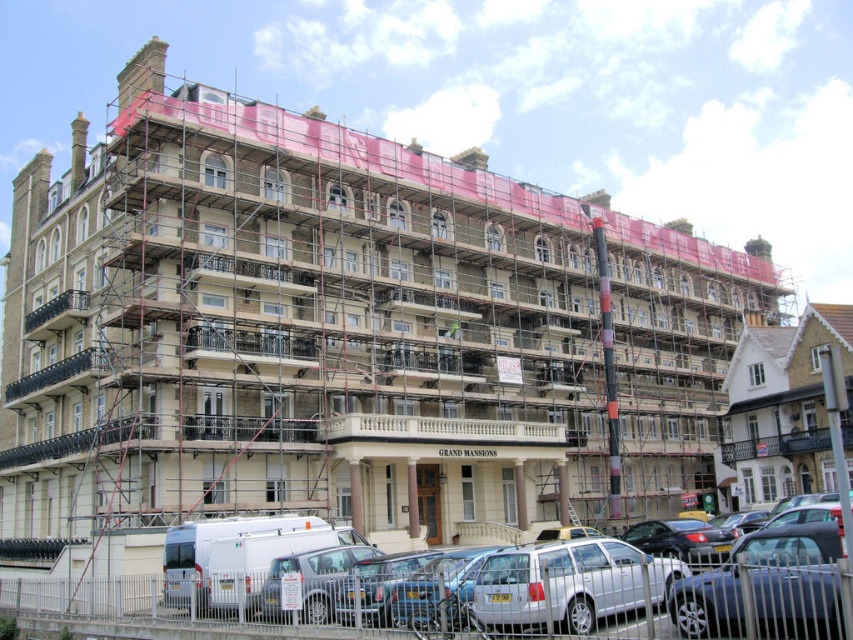
Question: Which point is farther to the camera?

Choices:
 (A) (521, 573)
 (B) (834, 314)

Answer: (B)

Question: Is white wooden house at right above silver metallic car at lower center?

Choices:
 (A) no
 (B) yes

Answer: (B)

Question: Which object appears farthest from the camera in this image?

Choices:
 (A) metallic silver car at lower right
 (B) white matte van at lower left
 (C) silver metallic car at lower center

Answer: (C)

Question: From the image, what is the correct spatial relationship of white matte van at lower left in relation to metallic silver car at lower right?

Choices:
 (A) above
 (B) below

Answer: (B)

Question: Which point appears closest to the camera in this image?

Choices:
 (A) (480, 573)
 (B) (695, 577)
 (C) (793, 333)
 (D) (569, 564)

Answer: (B)

Question: Is white wooden house at right below metallic silver car at lower right?

Choices:
 (A) yes
 (B) no

Answer: (B)